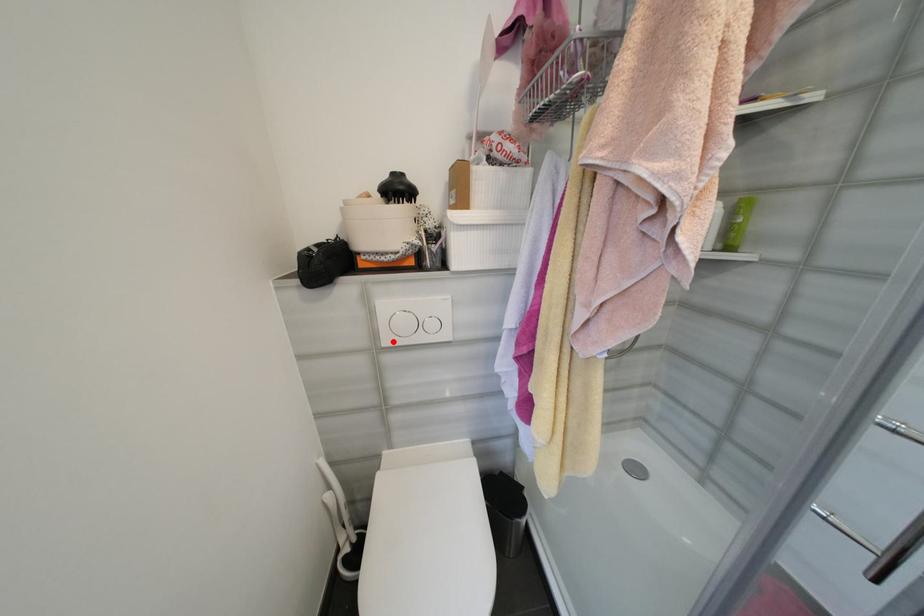
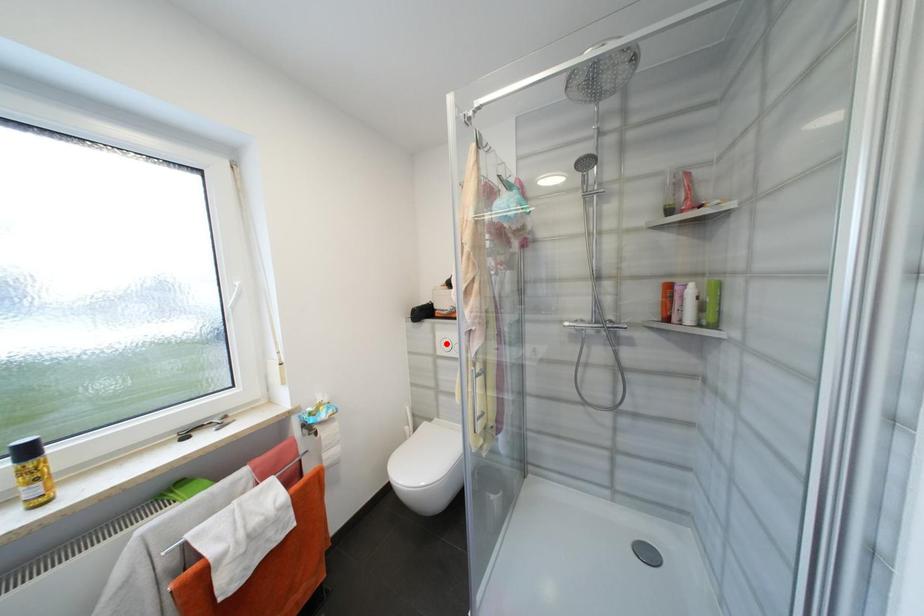
I am providing you with two images of the same scene from different viewpoints. A red point is marked on the first image and another point is marked on the second image. Is the marked point in image1 the same physical position as the marked point in image2?

No